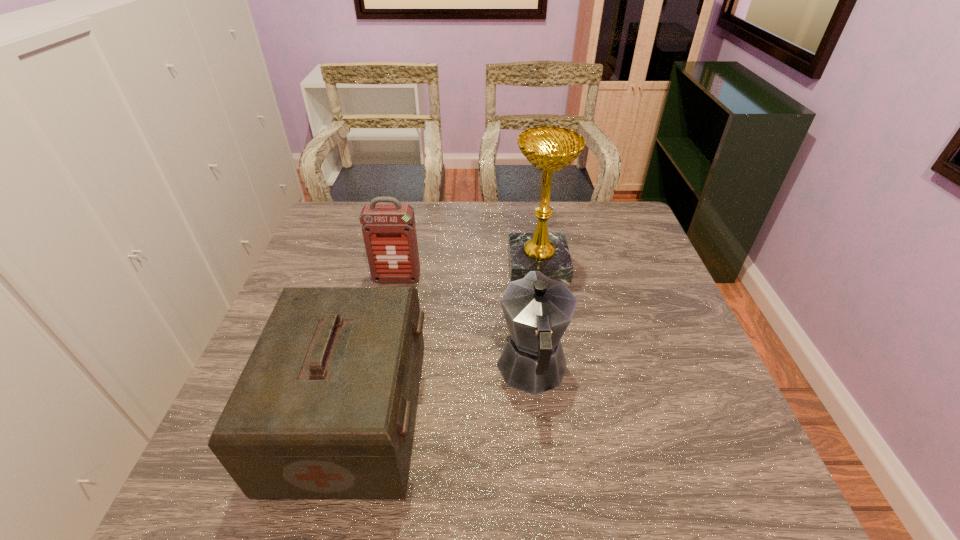
Identify the location of vacant space situated 0.160m at the spout of the coffeepot. This screenshot has width=960, height=540. (523, 289).

Locate an element on the screen. This screenshot has width=960, height=540. free space located on the back of the nearer first-aid kit is located at coordinates (376, 315).

Where is `object that is positioned at the near edge`? This screenshot has width=960, height=540. object that is positioned at the near edge is located at coordinates (325, 407).

Locate an element on the screen. This screenshot has width=960, height=540. object that is positioned at the left edge is located at coordinates (325, 407).

You are a GUI agent. You are given a task and a screenshot of the screen. Output one action in this format:
    pyautogui.click(x=<x>, y=<y>)
    Task: Click on the object that is at the near left corner
    
    Given the screenshot: What is the action you would take?
    pyautogui.click(x=325, y=407)

The width and height of the screenshot is (960, 540). Identify the location of vacant area at the far edge. point(459,201).

In the image, there is a desktop. Find the location of `vacant region at the near edge`. vacant region at the near edge is located at coordinates pyautogui.click(x=574, y=468).

Image resolution: width=960 pixels, height=540 pixels. Identify the location of vacant point at the left edge. (344, 269).

Where is `free space at the right edge`? The height and width of the screenshot is (540, 960). free space at the right edge is located at coordinates (634, 244).

Locate an element on the screen. vacant space at the far left corner is located at coordinates pyautogui.click(x=359, y=224).